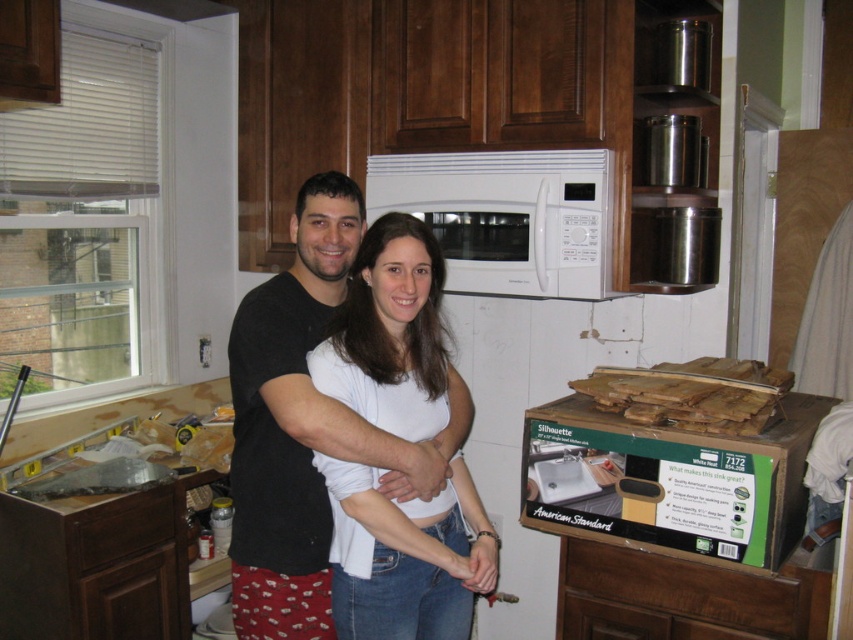
Who is higher up, white matte shirt at center or white matte microwave at upper center?

white matte microwave at upper center

Between white matte shirt at center and white matte microwave at upper center, which one has more height?

Standing taller between the two is white matte shirt at center.

Does point (461, 561) come closer to viewer compared to point (598, 193)?

Yes.

Locate an element on the screen. This screenshot has width=853, height=640. white matte shirt at center is located at coordinates (405, 557).

Looking at this image, is white matte microwave at upper center above wooden planks at lower center?

Indeed, white matte microwave at upper center is positioned over wooden planks at lower center.

Is point (503, 272) positioned in front of point (656, 380)?

No, (503, 272) is further to viewer.

Between point (460, 276) and point (709, 376), which one is positioned behind?

Point (460, 276)

What are the coordinates of `white matte microwave at upper center` in the screenshot? It's located at (508, 216).

Who is positioned more to the left, green cardboard box at lower right or white matte microwave at upper center?

white matte microwave at upper center

Can you confirm if green cardboard box at lower right is positioned above white matte microwave at upper center?

No.

Which is behind, point (595, 440) or point (454, 280)?

The point (454, 280) is behind.

The width and height of the screenshot is (853, 640). I want to click on green cardboard box at lower right, so click(x=669, y=481).